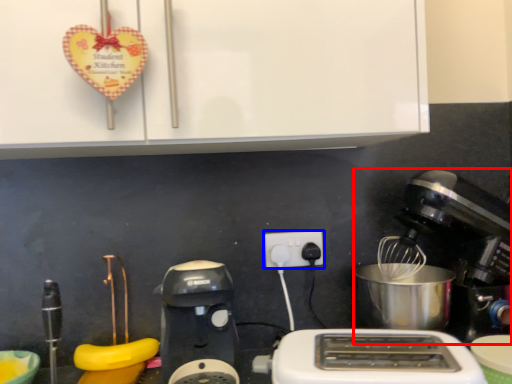
Question: Which object is further to the camera taking this photo, mixer (highlighted by a red box) or power plugs and sockets (highlighted by a blue box)?

Choices:
 (A) mixer
 (B) power plugs and sockets

Answer: (B)